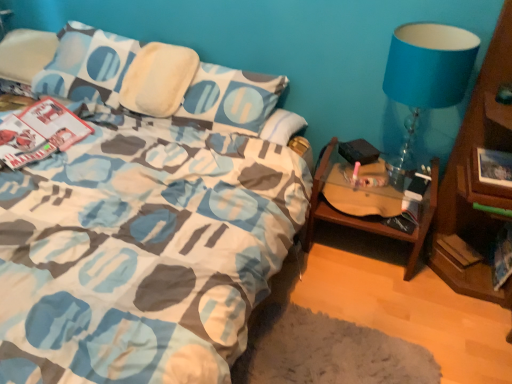
Question: Is woodenobject at right not near hardcover book at lower right?

Choices:
 (A) yes
 (B) no

Answer: (B)

Question: Does woodenobject at right have a larger size compared to hardcover book at lower right?

Choices:
 (A) yes
 (B) no

Answer: (A)

Question: Considering the relative positions of woodenobject at right and hardcover book at lower right in the image provided, is woodenobject at right behind hardcover book at lower right?

Choices:
 (A) yes
 (B) no

Answer: (B)

Question: Can we say woodenobject at right lies outside hardcover book at lower right?

Choices:
 (A) yes
 (B) no

Answer: (A)

Question: Can you confirm if woodenobject at right is wider than hardcover book at lower right?

Choices:
 (A) yes
 (B) no

Answer: (A)

Question: From a real-world perspective, is woodenobject at right over hardcover book at lower right?

Choices:
 (A) yes
 (B) no

Answer: (A)

Question: Can you confirm if blue fabric lampshade at upper right is wider than hardcover book at lower right?

Choices:
 (A) yes
 (B) no

Answer: (A)

Question: From the image's perspective, does blue fabric lampshade at upper right appear lower than hardcover book at lower right?

Choices:
 (A) no
 (B) yes

Answer: (A)

Question: Considering the relative sizes of blue fabric lampshade at upper right and hardcover book at lower right in the image provided, is blue fabric lampshade at upper right shorter than hardcover book at lower right?

Choices:
 (A) no
 (B) yes

Answer: (A)

Question: Is blue fabric lampshade at upper right bigger than hardcover book at lower right?

Choices:
 (A) yes
 (B) no

Answer: (A)

Question: Is hardcover book at lower right inside blue fabric lampshade at upper right?

Choices:
 (A) yes
 (B) no

Answer: (B)

Question: Is the depth of blue fabric lampshade at upper right less than that of hardcover book at lower right?

Choices:
 (A) yes
 (B) no

Answer: (A)

Question: Is hardcover book at lower right looking in the opposite direction of blue fabric lampshade at upper right?

Choices:
 (A) no
 (B) yes

Answer: (A)